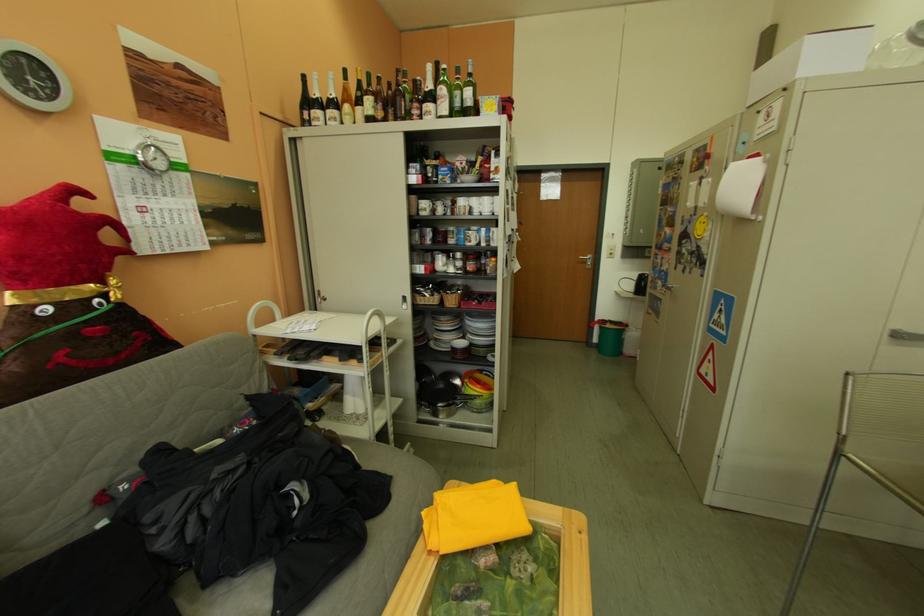
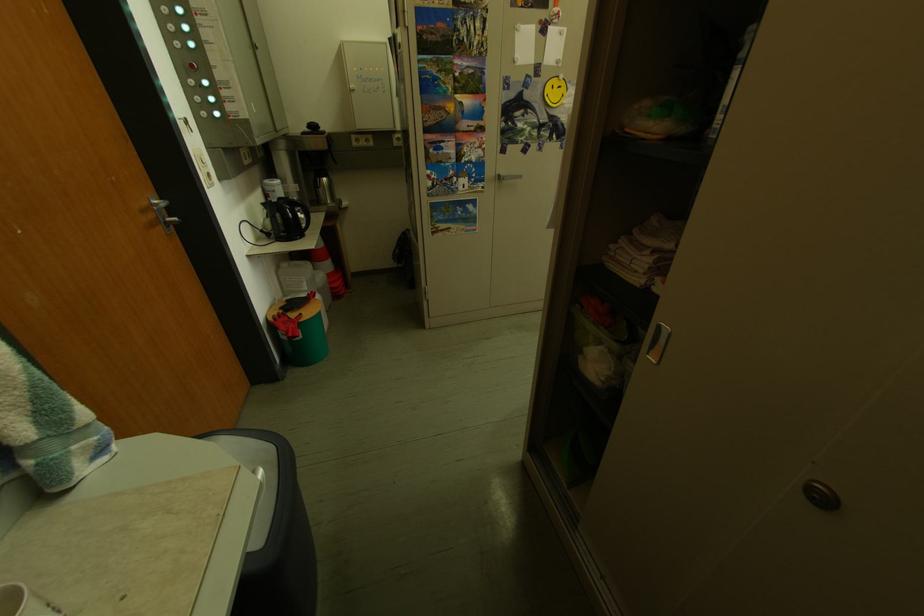
Find the pixel in the second image that matches (707,220) in the first image.

(546, 82)